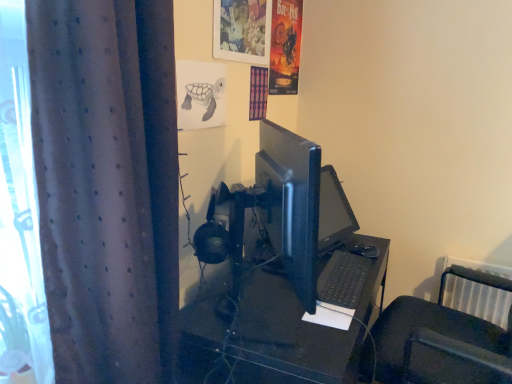
Question: Is matte plastic picture frame at upper center directly adjacent to black plastic keyboard at lower center?

Choices:
 (A) no
 (B) yes

Answer: (A)

Question: Is matte plastic picture frame at upper center bigger than black plastic keyboard at lower center?

Choices:
 (A) no
 (B) yes

Answer: (B)

Question: From a real-world perspective, is matte plastic picture frame at upper center under black plastic keyboard at lower center?

Choices:
 (A) no
 (B) yes

Answer: (A)

Question: Considering the relative sizes of matte plastic picture frame at upper center and black plastic keyboard at lower center in the image provided, is matte plastic picture frame at upper center smaller than black plastic keyboard at lower center?

Choices:
 (A) no
 (B) yes

Answer: (A)

Question: Is matte plastic picture frame at upper center oriented towards black plastic keyboard at lower center?

Choices:
 (A) no
 (B) yes

Answer: (A)

Question: In terms of width, does vibrant paper poster at upper right, the second poster page when ordered from left to right, look wider or thinner when compared to black plastic keyboard at lower center?

Choices:
 (A) thin
 (B) wide

Answer: (A)

Question: Is vibrant paper poster at upper right, which appears as the first poster page when viewed from the back, spatially inside black plastic keyboard at lower center, or outside of it?

Choices:
 (A) outside
 (B) inside

Answer: (A)

Question: Is point (295, 14) positioned closer to the camera than point (344, 253)?

Choices:
 (A) closer
 (B) farther

Answer: (B)

Question: In the image, is vibrant paper poster at upper right, the 2th poster page positioned from the bottom, on the left side or the right side of black plastic keyboard at lower center?

Choices:
 (A) right
 (B) left

Answer: (B)

Question: Considering the positions of satin black monitor at center and dark grey textured curtain at left in the image, is satin black monitor at center wider or thinner than dark grey textured curtain at left?

Choices:
 (A) wide
 (B) thin

Answer: (B)

Question: Is satin black monitor at center inside or outside of dark grey textured curtain at left?

Choices:
 (A) inside
 (B) outside

Answer: (B)

Question: Looking at the image, does satin black monitor at center seem bigger or smaller compared to dark grey textured curtain at left?

Choices:
 (A) small
 (B) big

Answer: (A)

Question: Is satin black monitor at center taller or shorter than dark grey textured curtain at left?

Choices:
 (A) tall
 (B) short

Answer: (B)

Question: Which is correct: matte plastic picture frame at upper center is inside black plastic desk at center, or outside of it?

Choices:
 (A) outside
 (B) inside

Answer: (A)

Question: In terms of size, does matte plastic picture frame at upper center appear bigger or smaller than black plastic desk at center?

Choices:
 (A) small
 (B) big

Answer: (A)